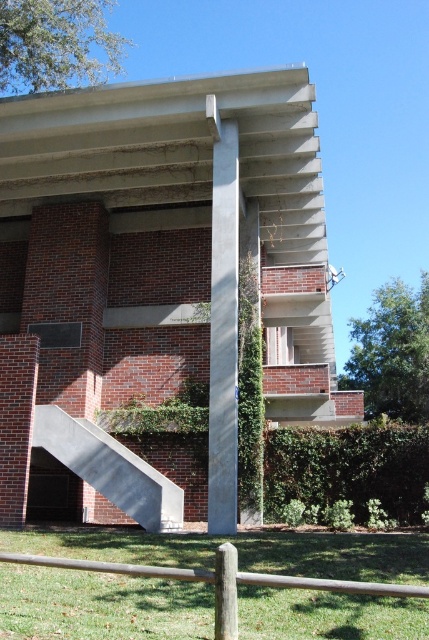
Does concrete pillar at center appear on the right side of wooden post at lower center?

Yes, concrete pillar at center is to the right of wooden post at lower center.

Does point (214, 205) come closer to viewer compared to point (232, 564)?

No, (214, 205) is behind (232, 564).

The image size is (429, 640). In order to click on concrete pillar at center in this screenshot , I will do `click(223, 324)`.

The width and height of the screenshot is (429, 640). Identify the location of concrete pillar at center. (223, 324).

Is concrete pillar at center smaller than concrete/stone staircase at lower left?

Yes.

Measure the distance between point (224, 285) and camera.

The distance of point (224, 285) from camera is 12.71 meters.

Find the location of a particular element. concrete pillar at center is located at coordinates (x=223, y=324).

Between concrete pillar at center and brown wooden post at lower center, which one appears on the left side from the viewer's perspective?

Positioned to the left is brown wooden post at lower center.

Find the location of a particular element. This screenshot has height=640, width=429. concrete pillar at center is located at coordinates (223, 324).